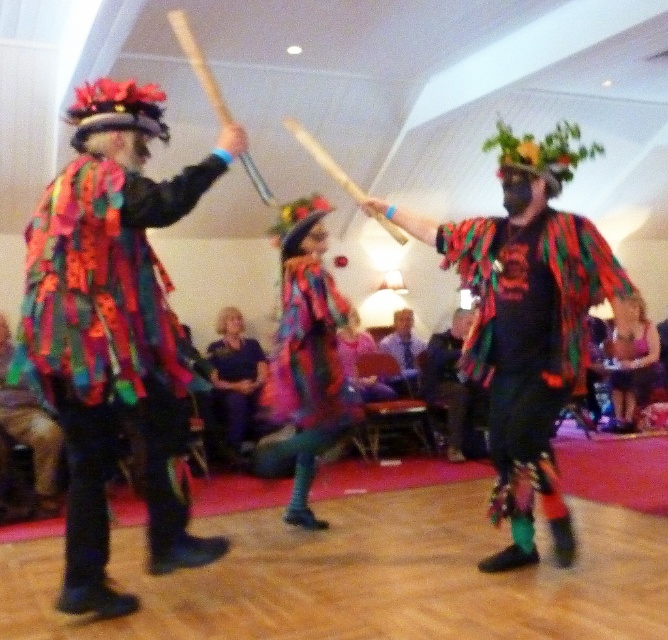
You are a photographer trying to capture the vibrant colors of the multicolored fabric scarf at center and the purple fabric dress at center. Which object should you focus on if you want to capture a wider area in your photo?

The multicolored fabric scarf at center might be wider than purple fabric dress at center, so focusing on it would allow you to capture a wider area in your photo.

You are a photographer trying to capture the multicolored fabric cape at left and the multicolored fabric dress at lower right in the same frame. Which object should you focus on first to ensure both are in the shot?

You should focus on the multicolored fabric dress at lower right first because the multicolored fabric cape at left is positioned on the left side of it, so by centering the dress, the cape will naturally be included in the frame to its left.